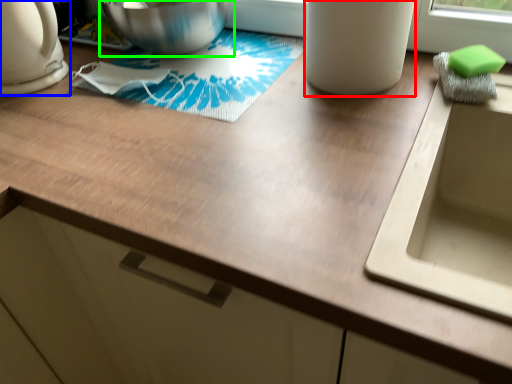
Question: Which object is positioned closest to appliance (highlighted by a red box)? Select from kitchen appliance (highlighted by a blue box) and mixing bowl (highlighted by a green box).

Choices:
 (A) kitchen appliance
 (B) mixing bowl

Answer: (B)